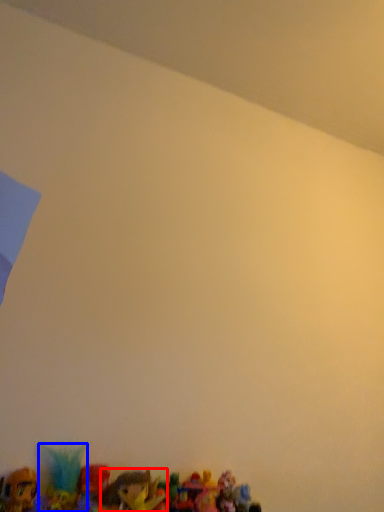
Question: Which object is further to the camera taking this photo, toy (highlighted by a red box) or toy (highlighted by a blue box)?

Choices:
 (A) toy
 (B) toy

Answer: (B)